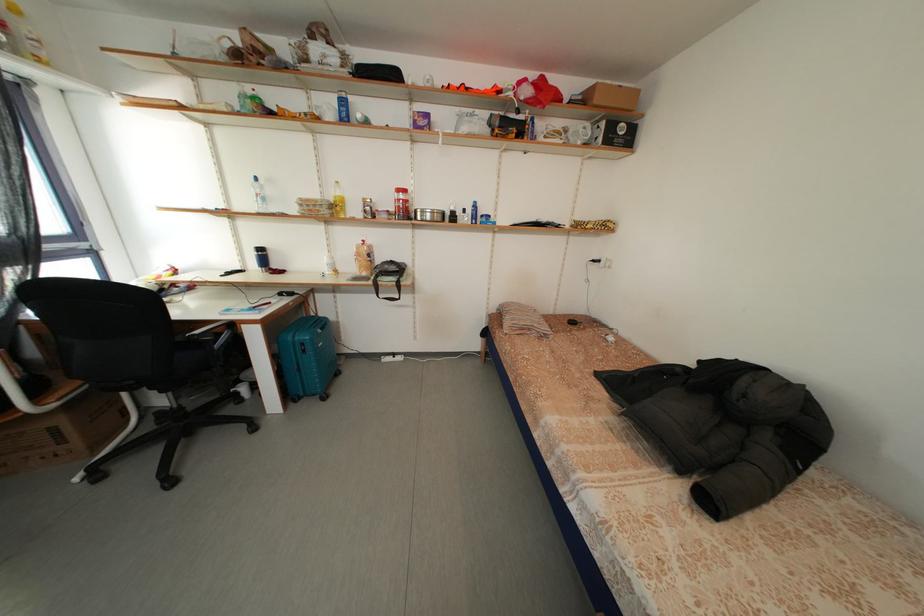
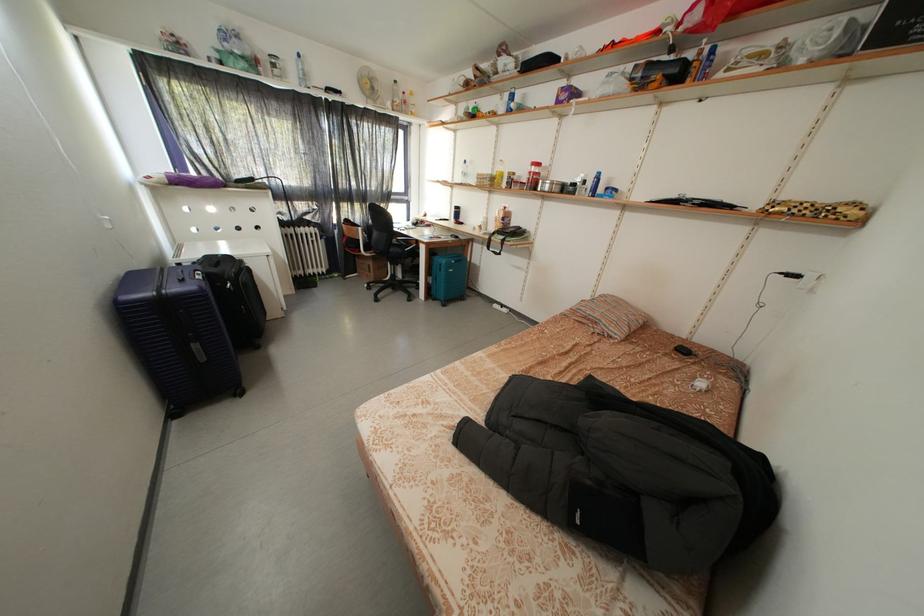
Locate, in the second image, the point that corresponds to [395,207] in the first image.

(530, 180)